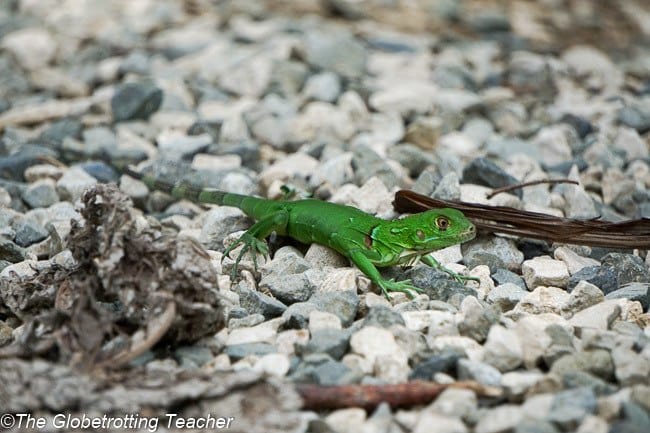
The image size is (650, 433). In order to click on left front leg in this screenshot , I will do `click(430, 260)`.